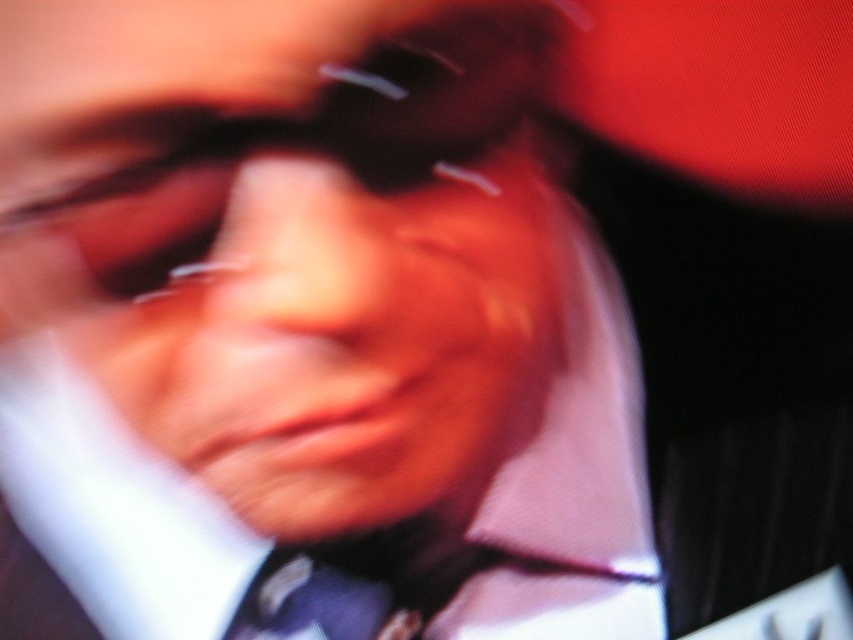
Which is more to the right, matte white face at center or dark blue textured tie at center?

matte white face at center is more to the right.

Measure the distance between point [401,397] and camera.

The distance of point [401,397] from camera is 11.20 inches.

I want to click on matte white face at center, so click(289, 240).